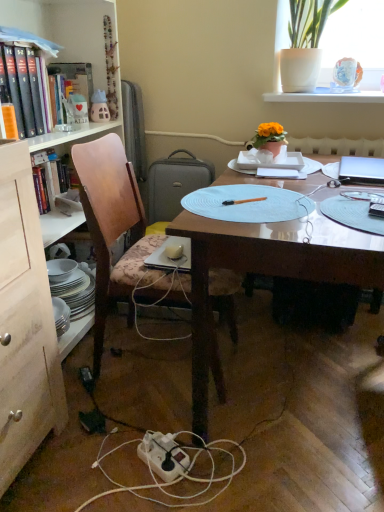
Locate an element on the screen. This screenshot has width=384, height=512. free location to the left of white plastic power plugs and sockets at lower center, the 2th power plugs and sockets in the back-to-front sequence is located at coordinates (64, 431).